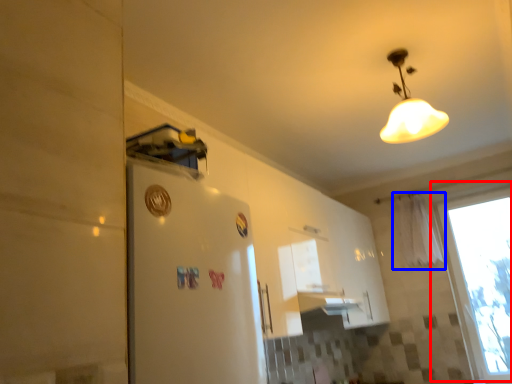
Question: Which object is closer to the camera taking this photo, window (highlighted by a red box) or curtain (highlighted by a blue box)?

Choices:
 (A) window
 (B) curtain

Answer: (A)